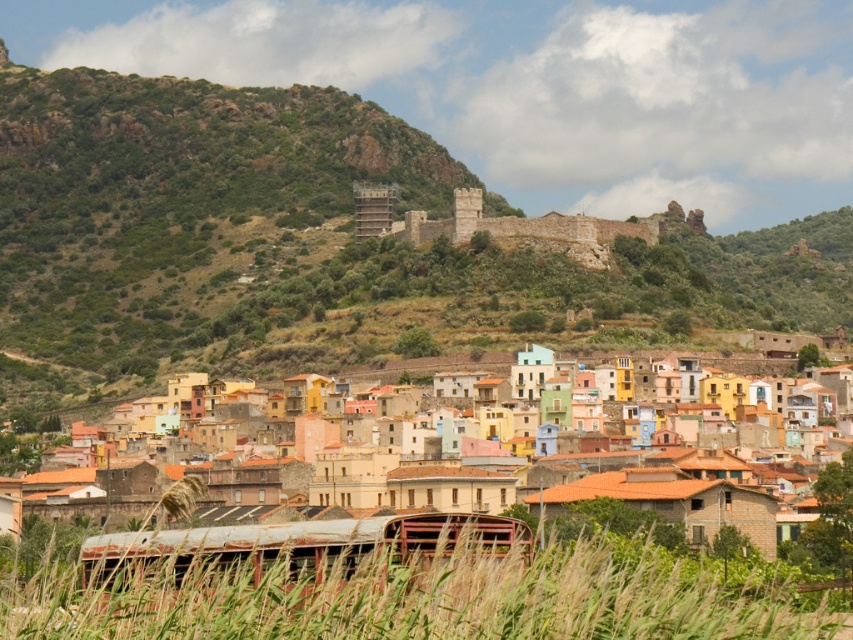
You are standing at the base of the hillside, looking up at the multicolored stone village at center. If you want to take a photo that captures the entire village in one shot, would you need to zoom in or zoom out your camera lens?

The multicolored stone village at center is 103.94 meters away from the camera. To capture the entire village in one shot, you would need to zoom out to widen the field of view so that the entire village fits within the frame.

You are a photographer planning to capture a wide shot of the town. You have a camera that can only focus on objects wider than 1 meter. Given the rusty metal train at lower center and the stone castle at center, which object will definitely be in focus?

The stone castle at center will definitely be in focus because its width is greater than the rusty metal train at lower center, which is narrower than 1 meter.